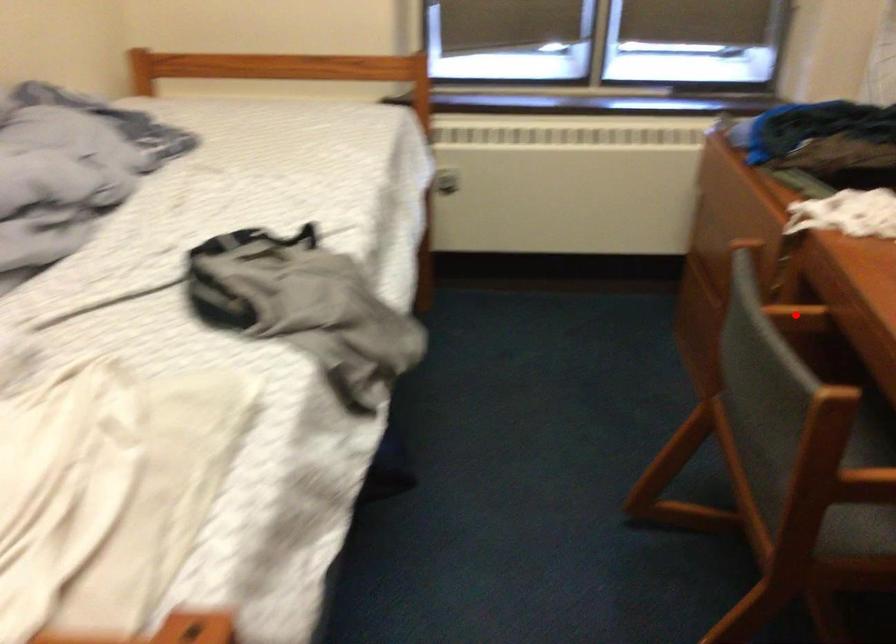
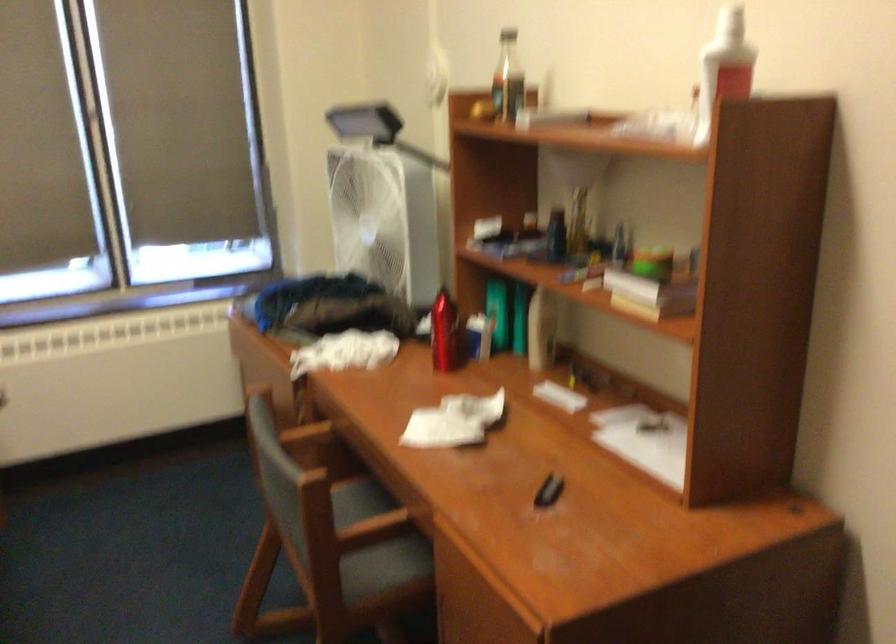
Question: I am providing you with two images of the same scene from different viewpoints. A red point is marked on the first image. Can you still see the location of the red point in image 2?

Choices:
 (A) Yes
 (B) No

Answer: (A)